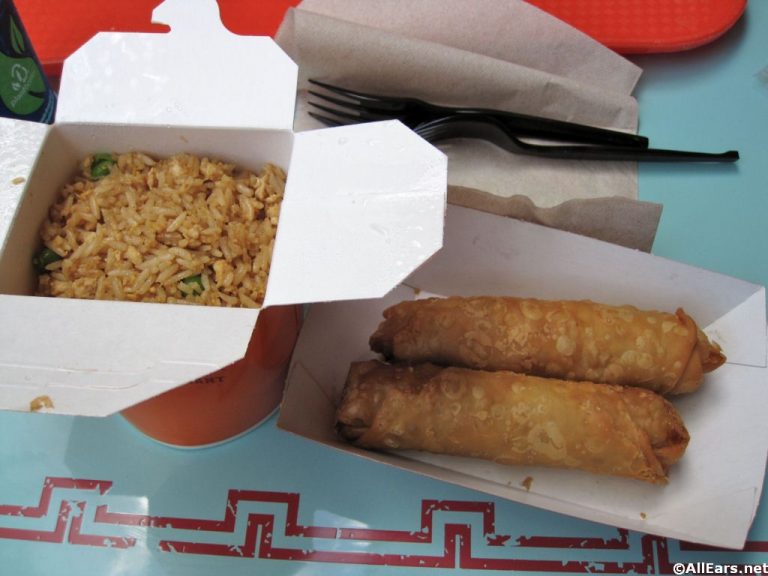
I want to click on forks, so click(378, 109), click(535, 151).